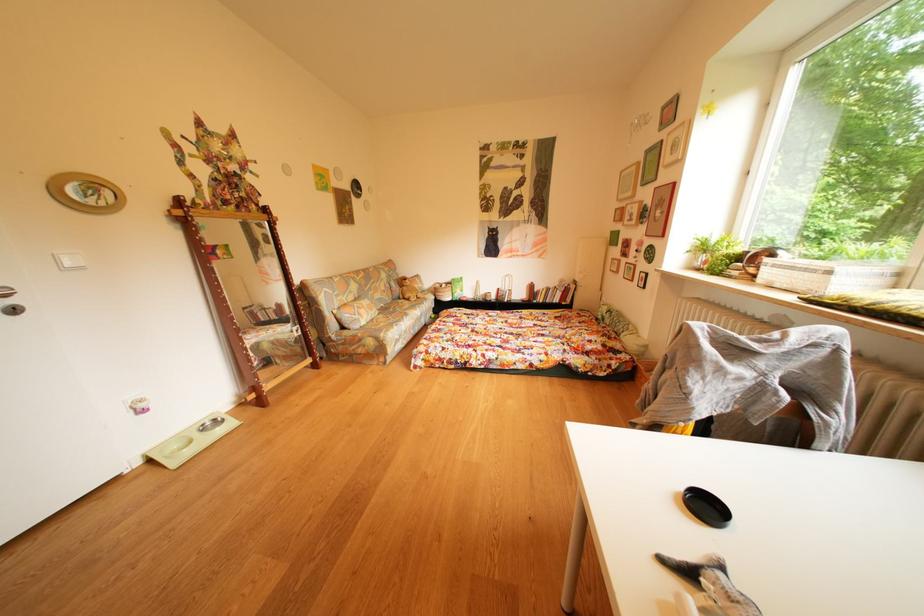
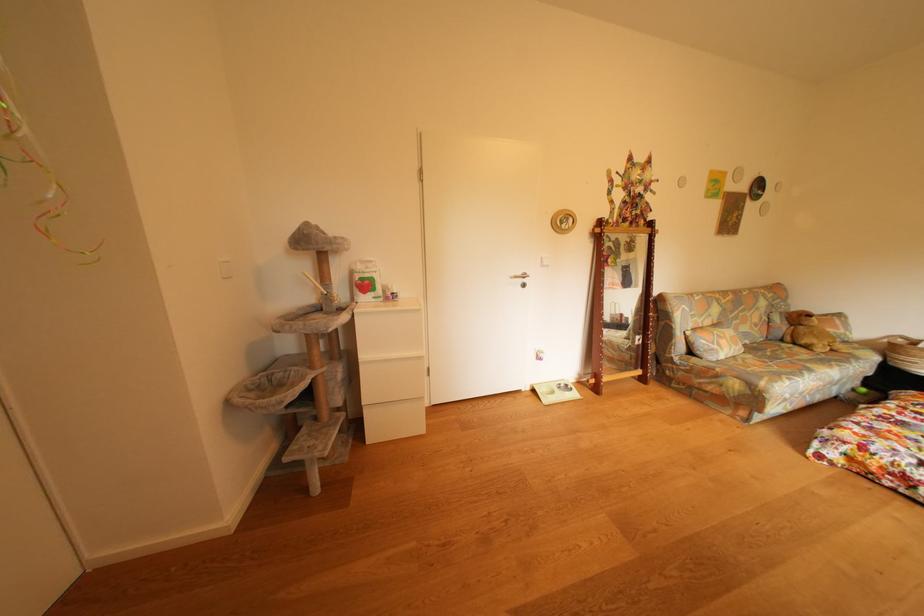
Question: The camera is either moving clockwise (left) or counter-clockwise (right) around the object. The first image is from the beginning of the video and the second image is from the end. Is the camera moving left or right when shooting the video?

Choices:
 (A) Left
 (B) Right

Answer: (B)